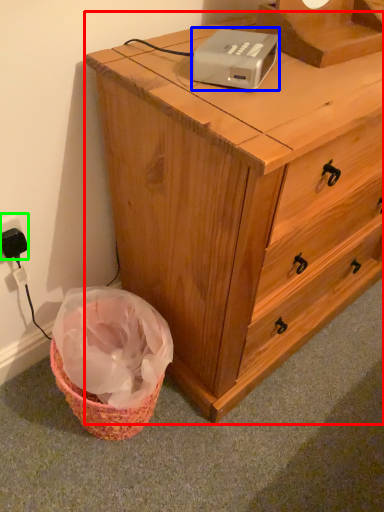
Question: Considering the real-world distances, which object is closest to chest of drawers (highlighted by a red box)? gadget (highlighted by a blue box) or electric outlet (highlighted by a green box).

Choices:
 (A) gadget
 (B) electric outlet

Answer: (A)